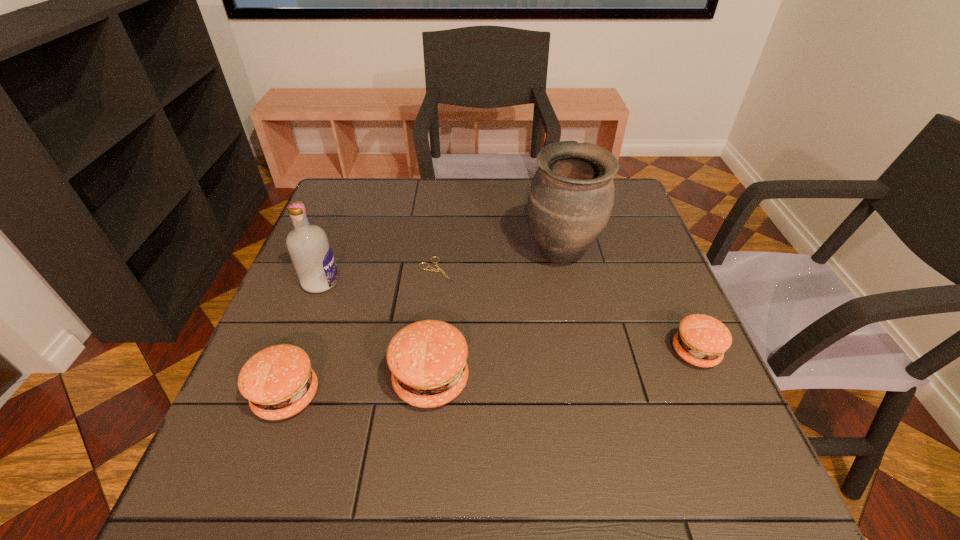
Locate an element on the screen. This screenshot has height=540, width=960. the leftmost patty is located at coordinates (278, 381).

What are the coordinates of `the second shortest patty` in the screenshot? It's located at (278, 381).

At what (x,y) coordinates should I click in order to perform the action: click on the tallest patty. Please return your answer as a coordinate pair (x, y). This screenshot has width=960, height=540. Looking at the image, I should click on (427, 358).

What are the coordinates of `the third tallest object` in the screenshot? It's located at (427, 358).

Where is `the shortest patty`? Image resolution: width=960 pixels, height=540 pixels. the shortest patty is located at coordinates (701, 340).

The width and height of the screenshot is (960, 540). I want to click on the rightmost patty, so click(x=701, y=340).

Identify the location of the second object from right to left. The width and height of the screenshot is (960, 540). (570, 200).

Identify the location of urn. Image resolution: width=960 pixels, height=540 pixels. (570, 200).

This screenshot has height=540, width=960. In order to click on the shortest object in this screenshot , I will do `click(431, 269)`.

This screenshot has width=960, height=540. I want to click on vodka, so click(x=309, y=248).